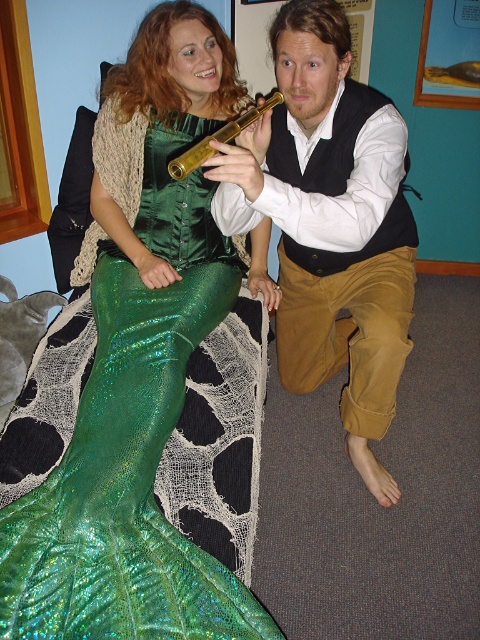
You are standing at the camera position and want to reach the point marked at coordinates (168, 134). If you take a step forward of 1.5 meters, will you reach that point?

The distance between the point marked at coordinates (168, 134) and the camera is 1.77 meters. Taking a step forward of 1.5 meters would leave you 0.27 meters short of the point, so you would not reach it.

You are a photographer setting up a shoot in this scene. You want to ensure that both the shiny green fabric at lower left and the matte black vest at center are clearly visible in the photo. Based on their positions, which object is closer to the camera?

The shiny green fabric at lower left is in front of the matte black vest at center, so it is closer to the camera and will appear more prominent in the photo.